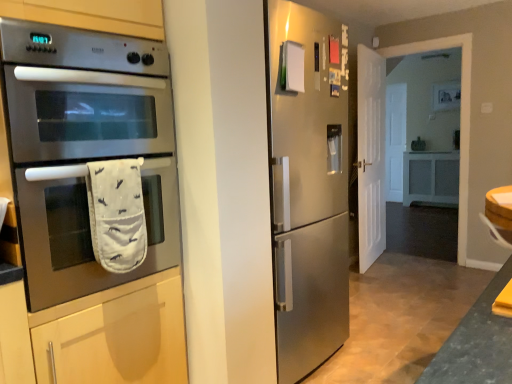
Question: Is point (81, 71) closer or farther from the camera than point (357, 150)?

Choices:
 (A) farther
 (B) closer

Answer: (B)

Question: From a real-world perspective, relative to white matte door at right, is stainless steel oven at left vertically above or below?

Choices:
 (A) above
 (B) below

Answer: (A)

Question: Considering the real-world distances, which object is closest to the white fabric oven mitt at lower left?

Choices:
 (A) stainless steel oven at left
 (B) white matte door at right

Answer: (A)

Question: Which of these objects is positioned farthest from the stainless steel oven at left?

Choices:
 (A) white matte door at right
 (B) white fabric oven mitt at lower left

Answer: (A)